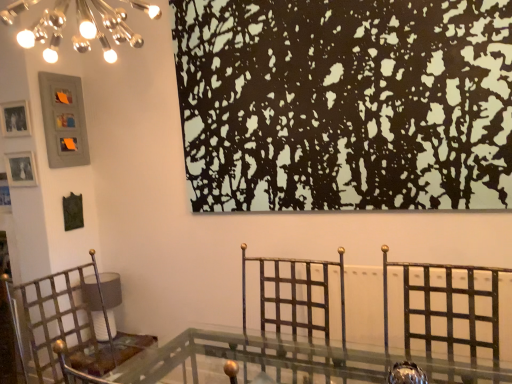
Question: Based on their sizes in the image, would you say black matte painting at upper center is bigger or smaller than metallic gold swivel chair at center?

Choices:
 (A) small
 (B) big

Answer: (B)

Question: From a real-world perspective, is black matte painting at upper center physically located above or below metallic gold swivel chair at center?

Choices:
 (A) below
 (B) above

Answer: (B)

Question: Estimate the real-world distances between objects in this image. Which object is closer to the black matte painting at upper center?

Choices:
 (A) matte gray picture frame at upper left, marked as the first picture frame in a top-to-bottom arrangement
 (B) metallic gold swivel chair at center
 (C) metallic/golden chair at left
 (D) matte silver picture frame at upper left, which ranks as the second picture frame in bottom-to-top order
 (E) matte silver picture frame at left, the 1th picture frame ordered from the bottom

Answer: (B)

Question: Based on their relative distances, which object is nearer to the matte silver picture frame at left, the 1th picture frame ordered from the bottom?

Choices:
 (A) matte gray picture frame at upper left, the 3th picture frame in the bottom-to-top sequence
 (B) metallic/golden chair at left
 (C) metallic gold swivel chair at center
 (D) black matte painting at upper center
 (E) matte silver picture frame at upper left, the 2th picture frame positioned from the top

Answer: (E)